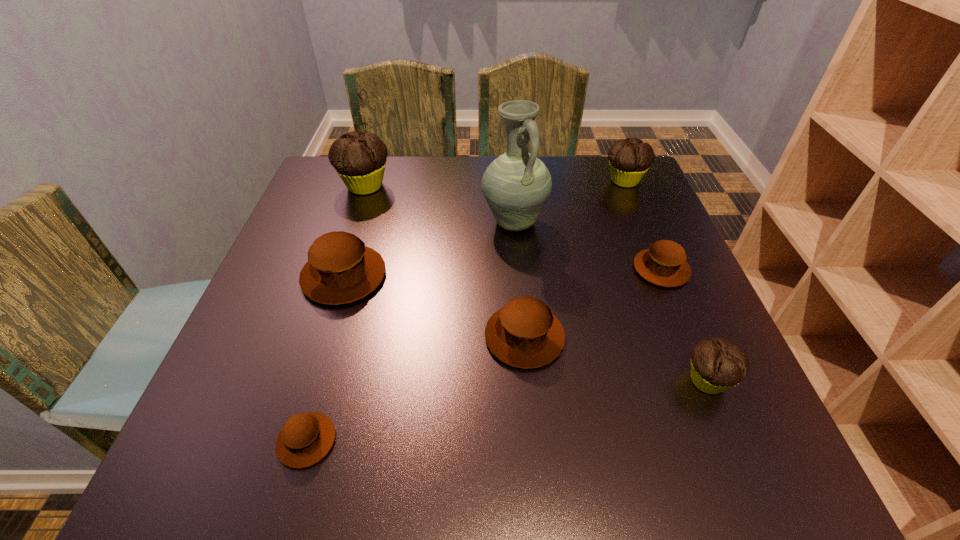
This screenshot has width=960, height=540. In order to click on object that is the third closest one to the leftmost chocolate muffin in this screenshot , I will do `click(524, 333)`.

I want to click on the fourth closest object to the second shortest object, so click(x=629, y=159).

The height and width of the screenshot is (540, 960). I want to click on muffin object that ranks as the third closest to the shortest muffin, so click(x=717, y=364).

Find the location of a particular element. the sixth closest muffin relative to the rightmost brown muffin is located at coordinates (306, 438).

Locate an element on the screen. chocolate muffin that stands as the second closest to the second biggest brown muffin is located at coordinates pos(359,159).

I want to click on chocolate muffin that stands as the second closest to the biggest brown muffin, so click(717, 364).

Identify which brown muffin is the second closest to the nearest chocolate muffin. Please provide its 2D coordinates. Your answer should be formatted as a tuple, i.e. [(x, y)], where the tuple contains the x and y coordinates of a point satisfying the conditions above.

[(524, 333)]

Identify which brown muffin is located as the second nearest to the tallest object. Please provide its 2D coordinates. Your answer should be formatted as a tuple, i.e. [(x, y)], where the tuple contains the x and y coordinates of a point satisfying the conditions above.

[(524, 333)]

This screenshot has width=960, height=540. Find the location of `vacant area that satisfies the following two spatial constraints: 1. on the front side of the fourth muffin from left to right; 2. on the right side of the smallest chocolate muffin`. vacant area that satisfies the following two spatial constraints: 1. on the front side of the fourth muffin from left to right; 2. on the right side of the smallest chocolate muffin is located at coordinates (528, 380).